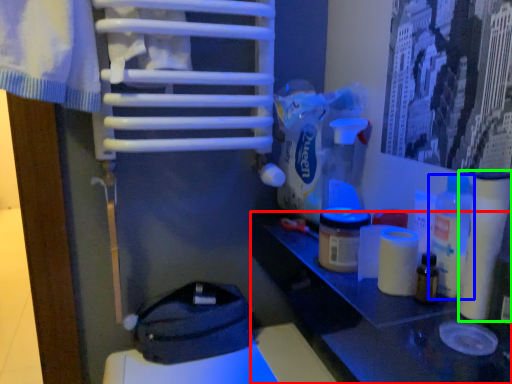
Question: Based on their relative distances, which object is nearer to table (highlighted by a red box)? Choose from bottle (highlighted by a blue box) and toilet paper (highlighted by a green box).

Choices:
 (A) bottle
 (B) toilet paper

Answer: (A)